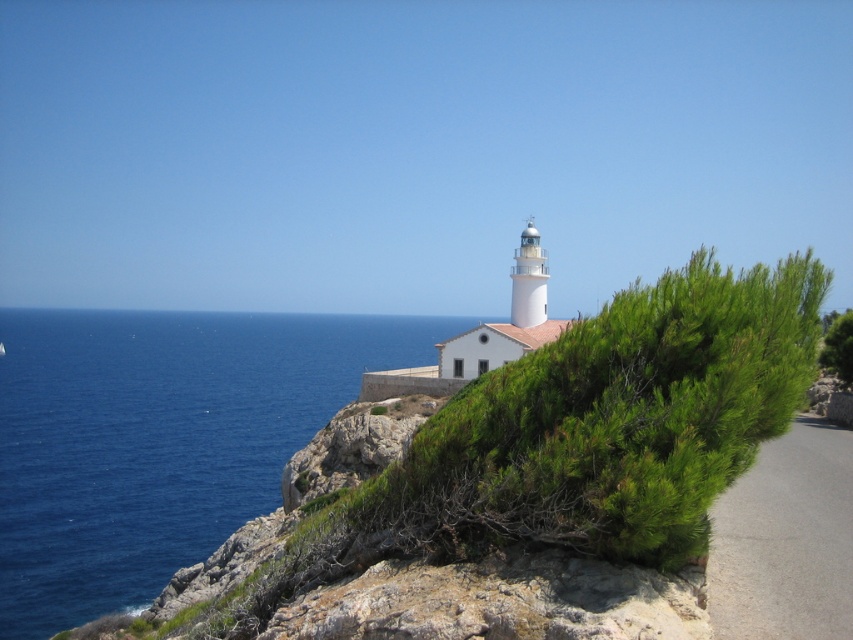
Question: Which point is closer to the camera taking this photo?

Choices:
 (A) (76, 604)
 (B) (843, 349)

Answer: (B)

Question: Does blue liquid water at left appear over green leafy shrub at upper right?

Choices:
 (A) yes
 (B) no

Answer: (B)

Question: Among these points, which one is farthest from the camera?

Choices:
 (A) (177, 372)
 (B) (834, 356)

Answer: (A)

Question: Where is blue liquid water at left located in relation to green leafy shrub at upper right in the image?

Choices:
 (A) right
 (B) left

Answer: (B)

Question: Can you confirm if blue liquid water at left is positioned above green leafy shrub at upper right?

Choices:
 (A) yes
 (B) no

Answer: (B)